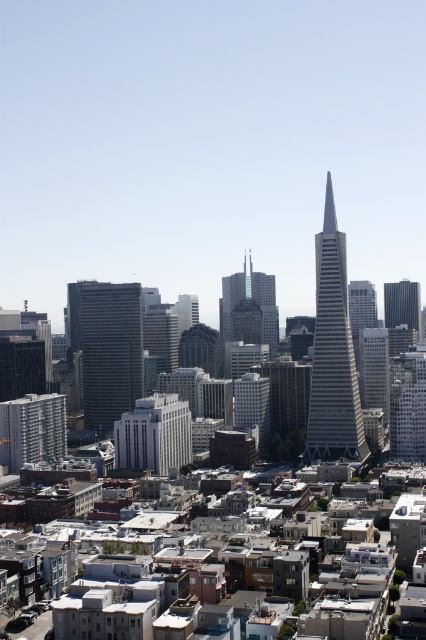
You are a drone pilot flying over the city. You need to deliver a package to the white smooth building at center and then to the black glass skyscraper at right. Which building should you visit first to minimize travel distance based on their positions?

You should visit the white smooth building at center first because it is closer to the viewer than the black glass skyscraper at right, so starting with the closer one reduces the total travel distance.

Based on the given coordinates, where exactly is the glassy silver skyscraper at center located in the image?

The glassy silver skyscraper at center is located at point coordinates of [333,353].

You are a drone operator trying to navigate between the glassy silver skyscraper at center and the white concrete building at lower left. Based on their positions, which building should you fly over to stay on course?

The glassy silver skyscraper at center is positioned over the white concrete building at lower left, so you should fly over the glassy silver skyscraper at center to stay on course.